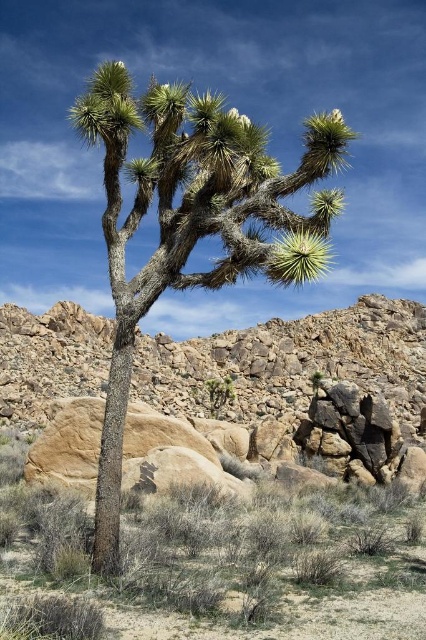
Question: From the image, what is the correct spatial relationship of brown textured rock at center in relation to green spiky tree at center?

Choices:
 (A) above
 (B) below

Answer: (B)

Question: Among these points, which one is farthest from the camera?

Choices:
 (A) (226, 554)
 (B) (100, 480)

Answer: (A)

Question: Which object appears closest to the camera in this image?

Choices:
 (A) green spiky tree at center
 (B) brown textured rock at center

Answer: (B)

Question: Is brown textured rock at center smaller than green spiky tree at center?

Choices:
 (A) yes
 (B) no

Answer: (A)

Question: Is brown textured rock at center smaller than green spiky tree at center?

Choices:
 (A) yes
 (B) no

Answer: (A)

Question: Which point appears closest to the camera in this image?

Choices:
 (A) (94, 99)
 (B) (218, 563)

Answer: (A)